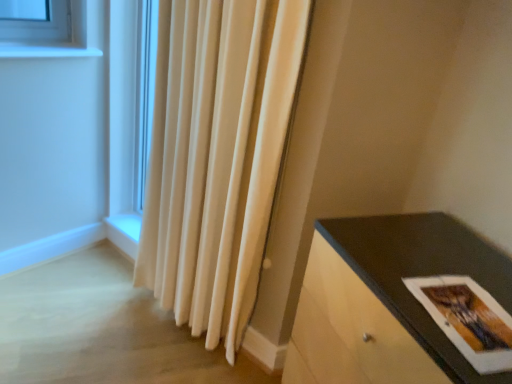
At what (x,y) coordinates should I click in order to perform the action: click on matte black table at lower right. Please return your answer as a coordinate pair (x, y). Looking at the image, I should click on (387, 301).

From a real-world perspective, which object rests below the other?

From a 3D spatial view, matte black table at lower right is below.

From the image's perspective, which is below, matte black table at lower right or white velvet curtain at center?

matte black table at lower right, from the image's perspective.

Is white velvet curtain at center at the back of matte black table at lower right?

matte black table at lower right does not have its back to white velvet curtain at center.

Is matte black table at lower right further to camera compared to white velvet curtain at center?

That is False.

Is white velvet curtain at center bigger than matte paper postcard at lower right?

Indeed, white velvet curtain at center has a larger size compared to matte paper postcard at lower right.

Is white velvet curtain at center positioned beyond the bounds of matte paper postcard at lower right?

Yes, white velvet curtain at center is outside of matte paper postcard at lower right.

The height and width of the screenshot is (384, 512). In order to click on postcard in front of the white velvet curtain at center in this screenshot , I will do `click(468, 319)`.

From the image's perspective, is white velvet curtain at center beneath matte paper postcard at lower right?

Incorrect, from the image's perspective, white velvet curtain at center is higher than matte paper postcard at lower right.

Is white velvet curtain at center situated inside matte black table at lower right or outside?

white velvet curtain at center is not inside matte black table at lower right, it's outside.

From the image's perspective, which one is positioned higher, white velvet curtain at center or matte black table at lower right?

white velvet curtain at center, from the image's perspective.

What are the coordinates of `table that is below the white velvet curtain at center (from the image's perspective)` in the screenshot? It's located at (387, 301).

Between white velvet curtain at center and matte black table at lower right, which one has larger size?

matte black table at lower right.

Is matte paper postcard at lower right positioned beyond the bounds of white velvet curtain at center?

Yes.

Is point (477, 346) closer or farther from the camera than point (246, 180)?

Point (477, 346) appears to be closer to the viewer than point (246, 180).

Which is more to the left, matte paper postcard at lower right or white velvet curtain at center?

From the viewer's perspective, white velvet curtain at center appears more on the left side.

Considering the sizes of objects matte paper postcard at lower right and white velvet curtain at center in the image provided, who is smaller, matte paper postcard at lower right or white velvet curtain at center?

With smaller size is matte paper postcard at lower right.

Is matte black table at lower right positioned far away from matte paper postcard at lower right?

They are positioned close to each other.

From the image's perspective, does matte black table at lower right appear higher than matte paper postcard at lower right?

No, from the image's perspective, matte black table at lower right is not on top of matte paper postcard at lower right.

Which is more to the left, matte black table at lower right or matte paper postcard at lower right?

matte black table at lower right is more to the left.

Between matte black table at lower right and matte paper postcard at lower right, which one has smaller width?

With smaller width is matte paper postcard at lower right.

In the scene shown: What's the angular difference between matte paper postcard at lower right and matte black table at lower right's facing directions?

They differ by 6.12 degrees in their facing directions.

Consider the image. Could you tell me if matte paper postcard at lower right is facing matte black table at lower right?

No, matte paper postcard at lower right is not facing towards matte black table at lower right.

Based on their positions, is matte paper postcard at lower right located to the left or right of matte black table at lower right?

matte paper postcard at lower right is to the right of matte black table at lower right.

Where is `table on the right of the white velvet curtain at center`? table on the right of the white velvet curtain at center is located at coordinates (387, 301).

At what (x,y) coordinates should I click in order to perform the action: click on postcard above the white velvet curtain at center (from a real-world perspective). Please return your answer as a coordinate pair (x, y). Image resolution: width=512 pixels, height=384 pixels. Looking at the image, I should click on (468, 319).

When comparing their distances from matte paper postcard at lower right, does white velvet curtain at center or matte black table at lower right seem closer?

matte black table at lower right is positioned closer to the anchor matte paper postcard at lower right.

In the scene shown: Considering their positions, is white velvet curtain at center positioned further to matte black table at lower right than matte paper postcard at lower right?

Among the two, white velvet curtain at center is located further to matte black table at lower right.

Considering their positions, is matte black table at lower right positioned further to white velvet curtain at center than matte paper postcard at lower right?

Based on the image, matte paper postcard at lower right appears to be further to white velvet curtain at center.

Estimate the real-world distances between objects in this image. Which object is closer to matte black table at lower right, matte paper postcard at lower right or white velvet curtain at center?

The object closer to matte black table at lower right is matte paper postcard at lower right.

From the picture: When comparing their distances from matte paper postcard at lower right, does matte black table at lower right or white velvet curtain at center seem further?

white velvet curtain at center is positioned further to the anchor matte paper postcard at lower right.

When comparing their distances from white velvet curtain at center, does matte paper postcard at lower right or matte black table at lower right seem further?

matte paper postcard at lower right.

Identify the location of table located between white velvet curtain at center and matte paper postcard at lower right in the left-right direction. (387, 301).